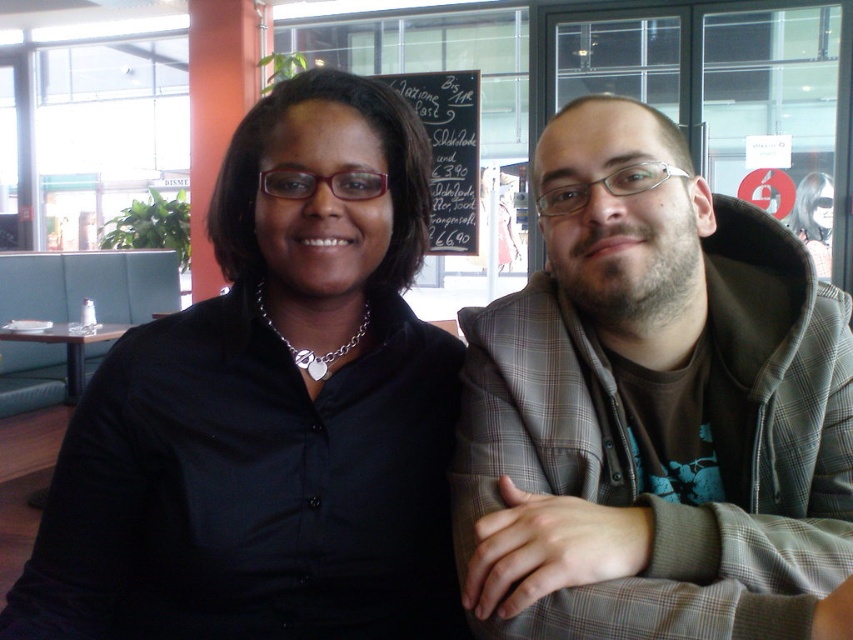
Question: Which of the following is the farthest from the observer?

Choices:
 (A) black shirt at center
 (B) wooden table at left
 (C) black chalkboard at upper center

Answer: (C)

Question: Is black shirt at center to the left of wooden table at left from the viewer's perspective?

Choices:
 (A) yes
 (B) no

Answer: (B)

Question: Which point appears farthest from the camera in this image?

Choices:
 (A) (202, 392)
 (B) (469, 109)
 (C) (4, 340)
 (D) (752, 524)

Answer: (B)

Question: Can you confirm if black shirt at center is positioned to the right of wooden table at left?

Choices:
 (A) yes
 (B) no

Answer: (A)

Question: Is black chalkboard at upper center behind wooden table at left?

Choices:
 (A) yes
 (B) no

Answer: (A)

Question: Which point appears closest to the camera in this image?

Choices:
 (A) (546, 296)
 (B) (428, 109)
 (C) (212, 566)
 (D) (24, 340)

Answer: (C)